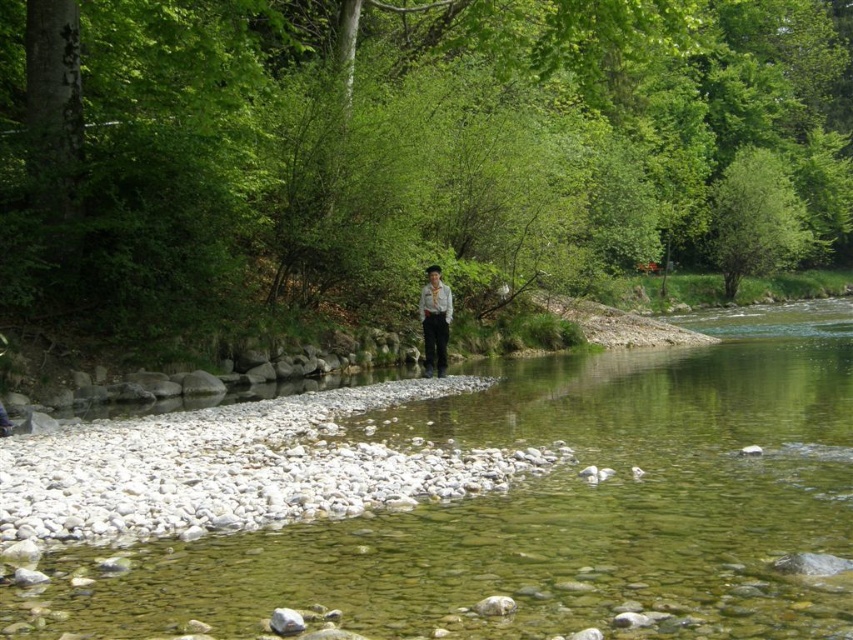
Between clear water at center and light brown fabric shirt at center, which one has less height?

clear water at center

Which is in front, point (780, 628) or point (445, 285)?

Point (780, 628) is in front.

At what (x,y) coordinates should I click in order to perform the action: click on clear water at center. Please return your answer as a coordinate pair (x, y). Looking at the image, I should click on (549, 509).